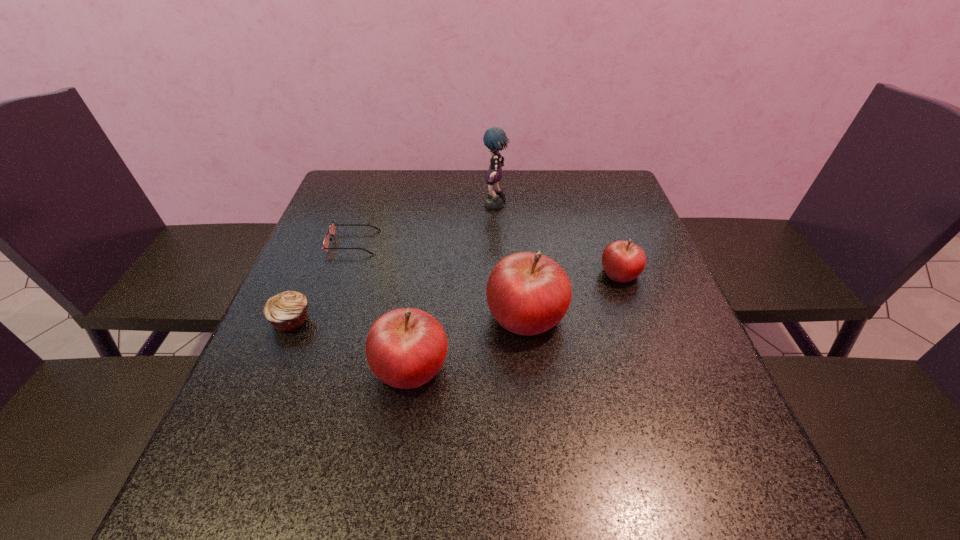
You are a GUI agent. You are given a task and a screenshot of the screen. Output one action in this format:
    pyautogui.click(x=<x>, y=<y>)
    Task: Click on the leftmost apple
    
    Given the screenshot: What is the action you would take?
    pyautogui.click(x=405, y=348)

Where is `the second tallest apple`? the second tallest apple is located at coordinates (405, 348).

Where is `the second apple from right to left`? The image size is (960, 540). the second apple from right to left is located at coordinates (528, 293).

This screenshot has width=960, height=540. Identify the location of the farthest apple. (623, 261).

You are a GUI agent. You are given a task and a screenshot of the screen. Output one action in this format:
    pyautogui.click(x=<x>, y=<y>)
    Task: Click on the rightmost apple
    
    Given the screenshot: What is the action you would take?
    pyautogui.click(x=623, y=261)

You are a GUI agent. You are given a task and a screenshot of the screen. Output one action in this format:
    pyautogui.click(x=<x>, y=<y>)
    Task: Click on the farthest object
    This screenshot has height=540, width=960.
    Given the screenshot: What is the action you would take?
    pyautogui.click(x=494, y=139)

You are a GUI agent. You are given a task and a screenshot of the screen. Output one action in this format:
    pyautogui.click(x=<x>, y=<y>)
    Task: Click on the rag doll
    
    Given the screenshot: What is the action you would take?
    pyautogui.click(x=494, y=139)

Find the location of a particular element. sunglasses is located at coordinates (331, 231).

Find the location of `the fifth nearest object`. the fifth nearest object is located at coordinates (331, 231).

The height and width of the screenshot is (540, 960). What are the coordinates of `muffin` in the screenshot? It's located at (287, 311).